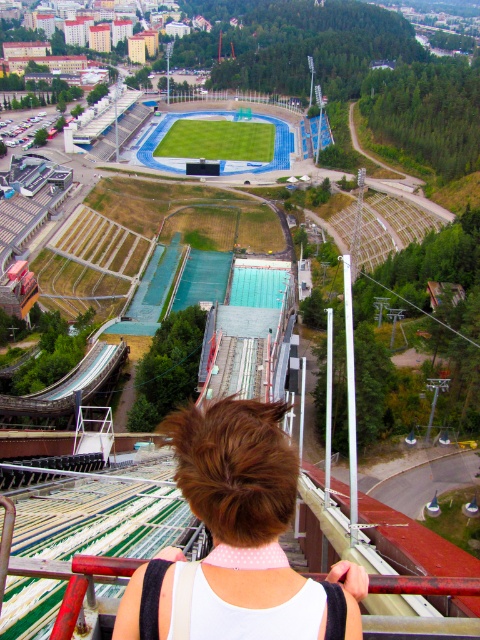
Is brown hair at center in front of green grass football field at center?

Yes, it is in front of green grass football field at center.

Is point (232, 554) more distant than point (259, 136)?

No, it is in front of (259, 136).

Locate an element on the screen. This screenshot has width=480, height=640. brown hair at center is located at coordinates (243, 518).

This screenshot has width=480, height=640. Identify the location of brown hair at center. (243, 518).